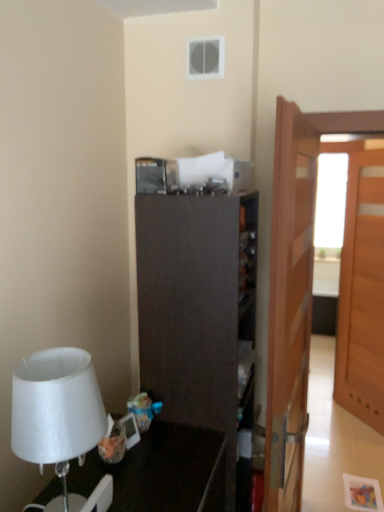
Where is `free region under light brown wooden door at right, the 2th door in the left-to-right sequence (from a real-world perspective)`? The image size is (384, 512). free region under light brown wooden door at right, the 2th door in the left-to-right sequence (from a real-world perspective) is located at coordinates (363, 422).